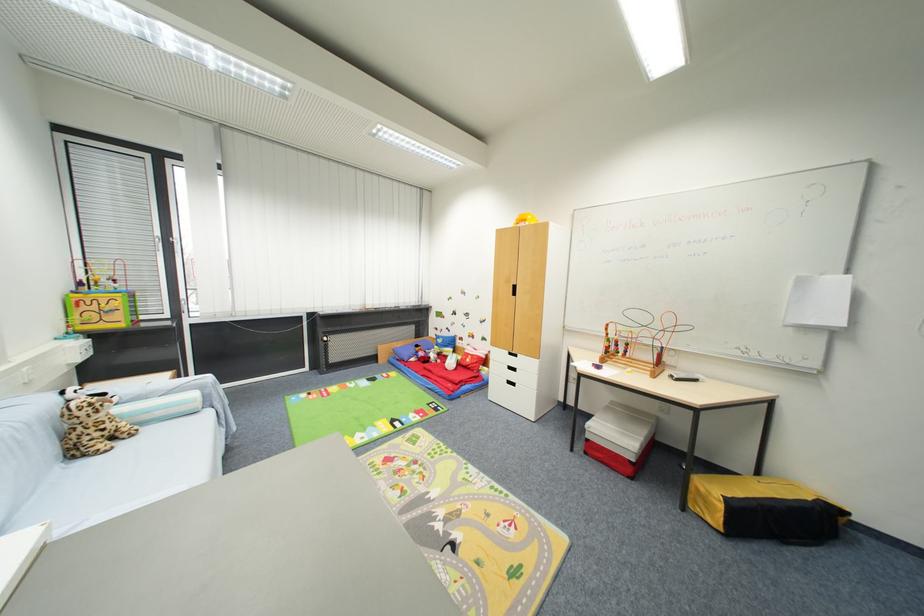
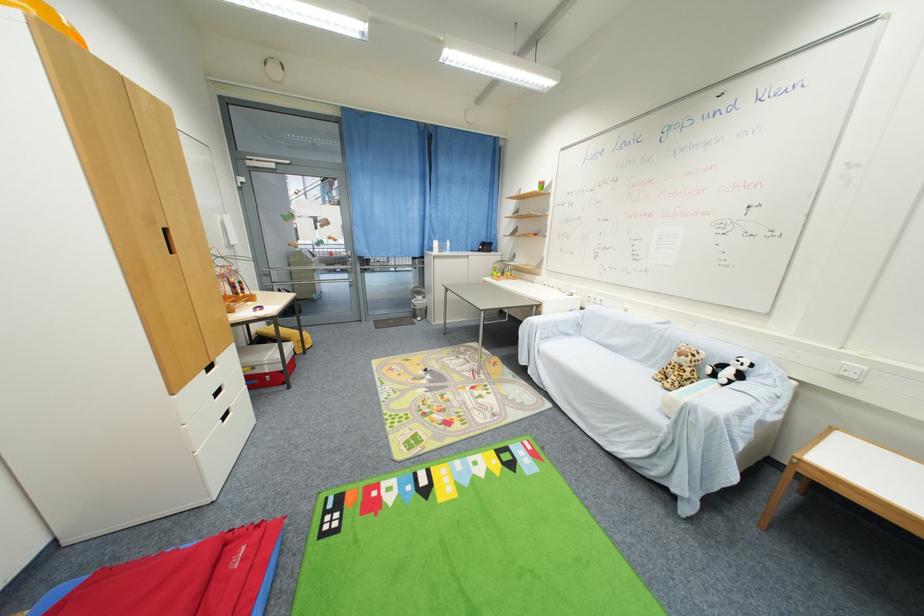
Locate, in the second image, the point that corresponds to the point at 129,431 in the first image.

(675, 382)